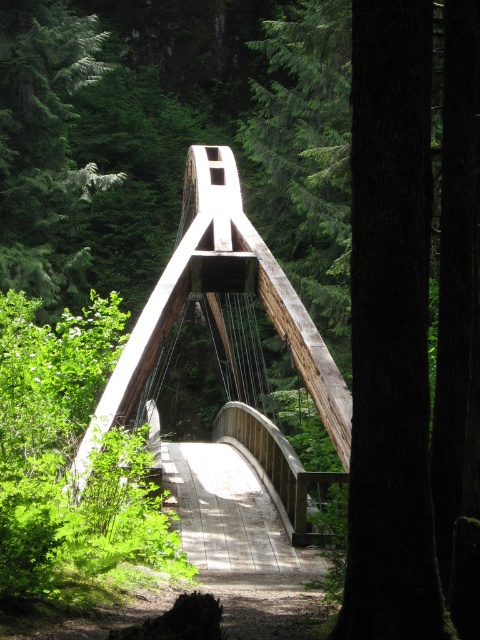
Is dark brown wood at center positioned before green textured tree at center?

That is True.

Between dark brown wood at center and green textured tree at center, which one is positioned lower?

dark brown wood at center is lower down.

Between point (421, 499) and point (31, 193), which one is positioned behind?

Positioned behind is point (31, 193).

Identify the location of dark brown wood at center. (391, 332).

Describe the element at coordinates (230, 339) in the screenshot. I see `wooden bridge at center` at that location.

Is wooden bridge at center wider than green textured tree at center?

Yes.

Does point (212, 291) come closer to viewer compared to point (49, 243)?

Yes.

Locate an element on the screen. Image resolution: width=480 pixels, height=640 pixels. wooden bridge at center is located at coordinates (230, 339).

Which is in front, point (358, 250) or point (192, 211)?

Positioned in front is point (358, 250).

Can you confirm if dark brown wood at center is positioned below wooden bridge at center?

Correct, dark brown wood at center is located below wooden bridge at center.

Is point (373, 349) positioned after point (119, 397)?

No.

At what (x,y) coordinates should I click in order to perform the action: click on dark brown wood at center. Please return your answer as a coordinate pair (x, y). Image resolution: width=480 pixels, height=640 pixels. Looking at the image, I should click on (391, 332).